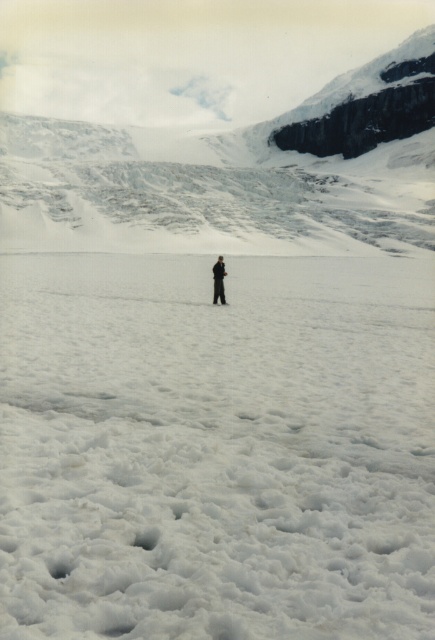
Question: Does snowy rock at upper center appear on the right side of blurred figure at center?

Choices:
 (A) yes
 (B) no

Answer: (A)

Question: Can you confirm if white fluffy snow at center is bigger than blurred figure at center?

Choices:
 (A) no
 (B) yes

Answer: (B)

Question: Observing the image, what is the correct spatial positioning of white fluffy snow at center in reference to blurred figure at center?

Choices:
 (A) below
 (B) above

Answer: (A)

Question: Which object is farther from the camera taking this photo?

Choices:
 (A) snowy rock at upper center
 (B) white fluffy snow at center
 (C) blurred figure at center

Answer: (A)

Question: Which object is farther from the camera taking this photo?

Choices:
 (A) snowy rock at upper center
 (B) blurred figure at center

Answer: (A)

Question: Which point is farther to the camera?

Choices:
 (A) tap(116, 35)
 (B) tap(214, 272)
 (C) tap(230, 323)

Answer: (A)